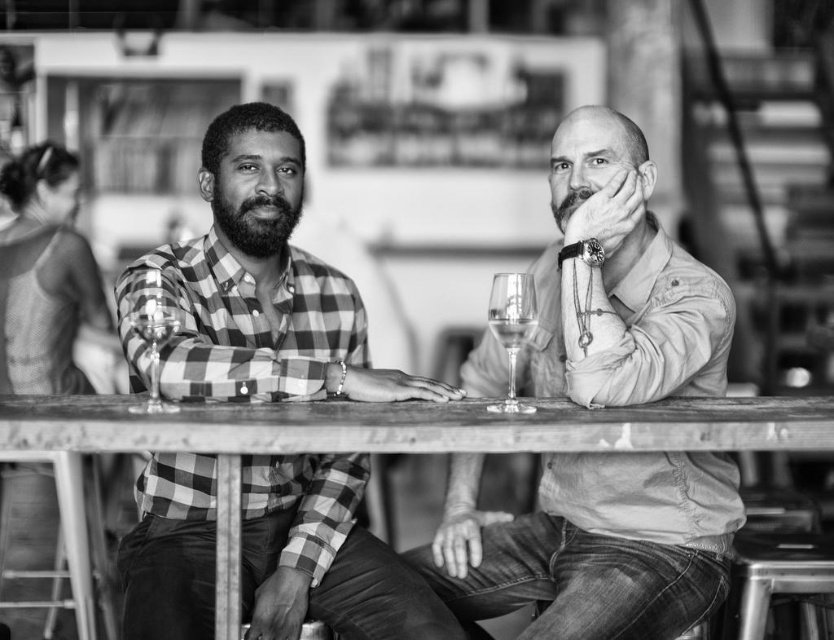
Question: Is the position of checkered fabric shirt at center less distant than that of wooden table at center?

Choices:
 (A) no
 (B) yes

Answer: (A)

Question: From the image, what is the correct spatial relationship of smooth beige shirt at center in relation to wooden table at center?

Choices:
 (A) left
 (B) right

Answer: (B)

Question: Which object is farther from the camera taking this photo?

Choices:
 (A) clear glass wine glass at left
 (B) smooth beige shirt at center

Answer: (B)

Question: Does checkered fabric shirt at center have a greater width compared to clear glass wine glass at left?

Choices:
 (A) no
 (B) yes

Answer: (B)

Question: Which of these objects is positioned closest to the clear glass wine glass at center?

Choices:
 (A) checkered fabric shirt at center
 (B) smooth beige shirt at center

Answer: (B)

Question: Estimate the real-world distances between objects in this image. Which object is farther from the clear glass wine glass at center?

Choices:
 (A) wooden table at center
 (B) checkered fabric shirt at center
 (C) clear glass at center
 (D) smooth beige shirt at center

Answer: (B)